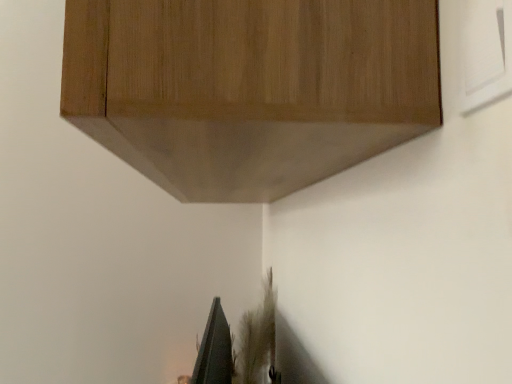
The height and width of the screenshot is (384, 512). I want to click on wooden cabinet at upper center, so click(249, 88).

What do you see at coordinates (249, 88) in the screenshot? I see `wooden cabinet at upper center` at bounding box center [249, 88].

What are the coordinates of `wooden cabinet at upper center` in the screenshot? It's located at (249, 88).